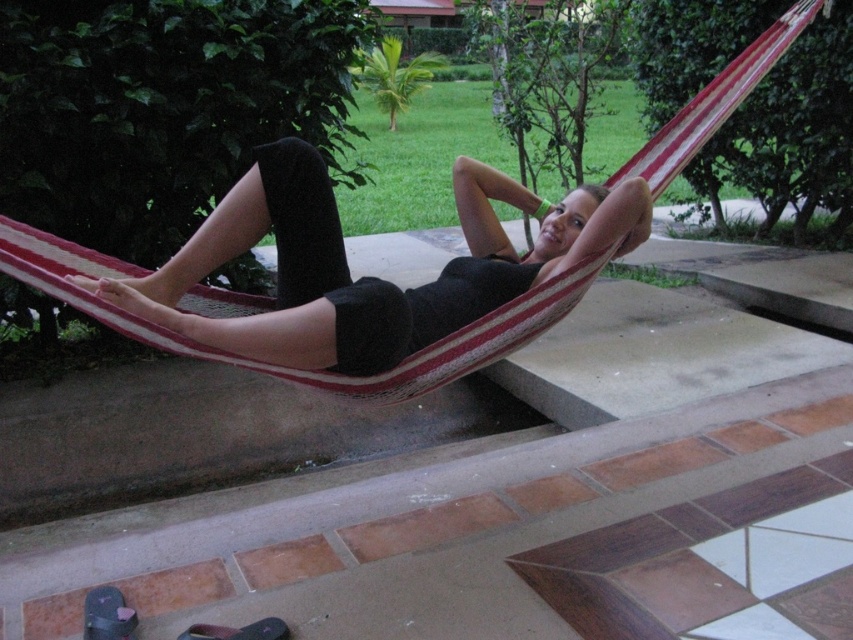
You are a delivery person trying to place a package on the floor near the striped fabric hammock at center without disturbing the black leather sandal at lower left. Can you fit the package between them?

The striped fabric hammock at center is much taller than the black leather sandal at lower left, so the space between them is sufficient to place the package without disturbing the sandal.

You are standing on the tiled area and see both the dark gray fabric sandal at lower left and the black leather sandal at lower left. Which sandal is closer to you?

The dark gray fabric sandal at lower left is closer to you because it is positioned further to the viewer than the black leather sandal at lower left.

You are a delivery person who needs to place a small package between the dark gray fabric sandal at lower left and the black leather sandal at lower left. Which sandal should you place the package closer to if you want it to be near the smaller object?

The black leather sandal at lower left is smaller, so you should place the package closer to the black leather sandal at lower left.